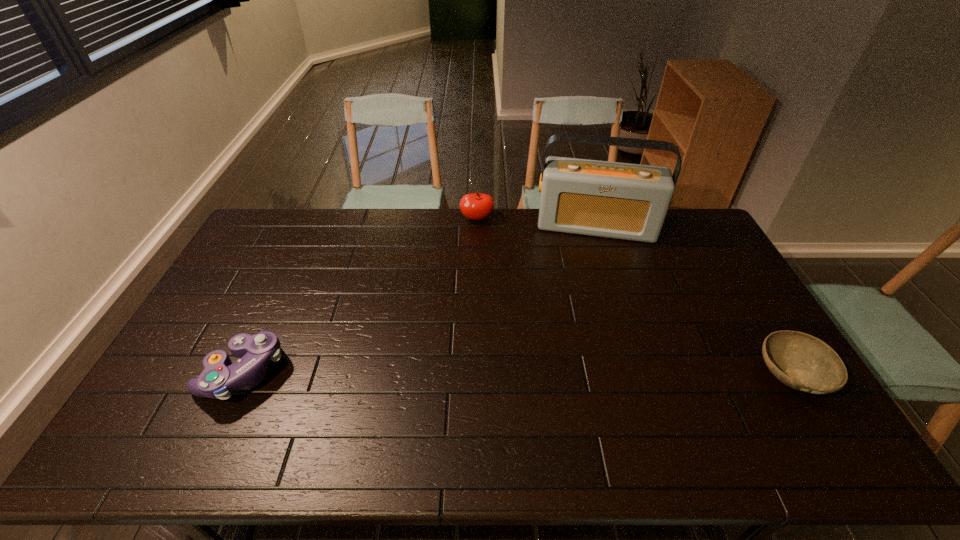
Locate an element on the screen. The width and height of the screenshot is (960, 540). free spot on the desktop that is between the leftmost object and the shortest object and is positioned on the stem of the third object from right to left is located at coordinates (452, 373).

Locate an element on the screen. vacant space on the desktop that is between the leftmost object and the bowl and is positioned on the front-facing side of the radio receiver is located at coordinates (594, 374).